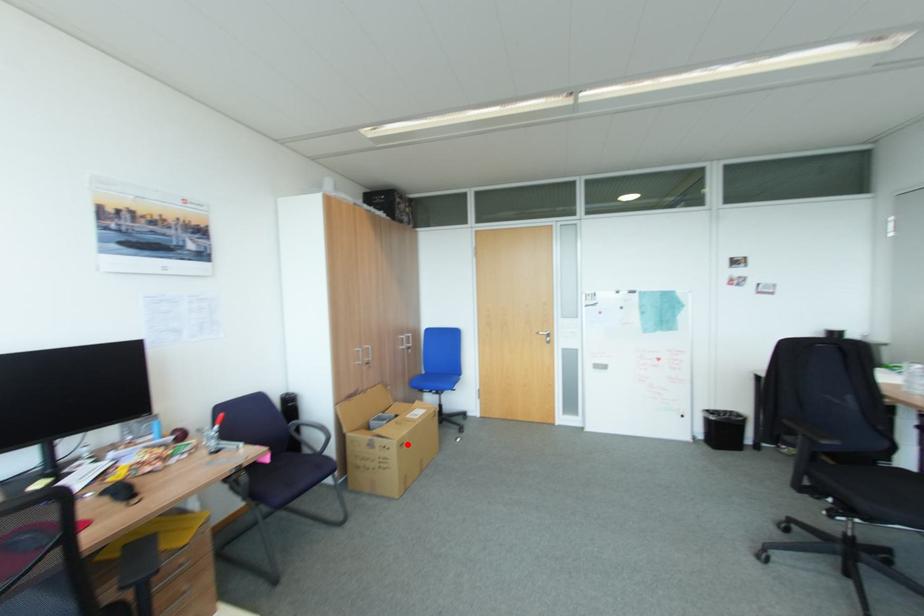
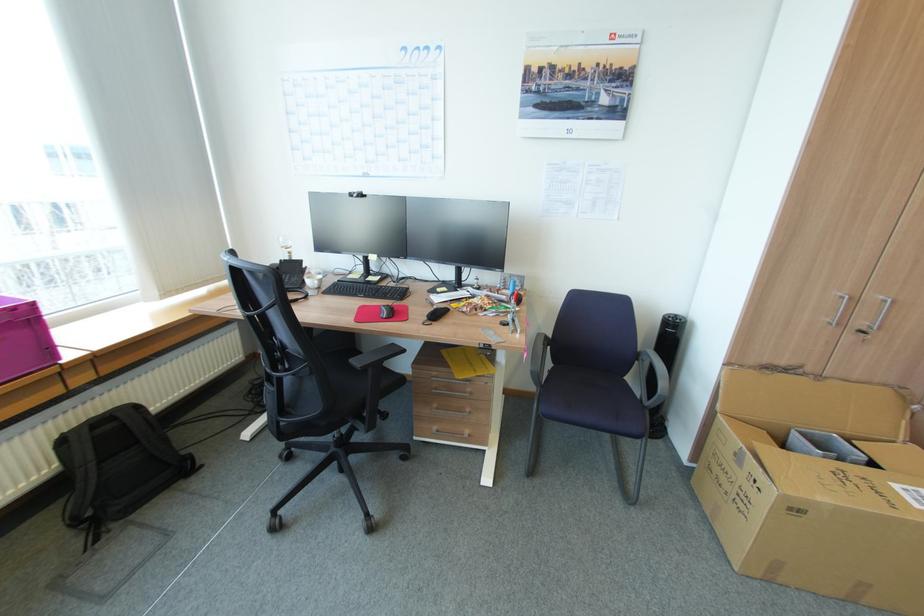
In the second image, find the point that corresponds to the highlighted location in the first image.

(804, 511)